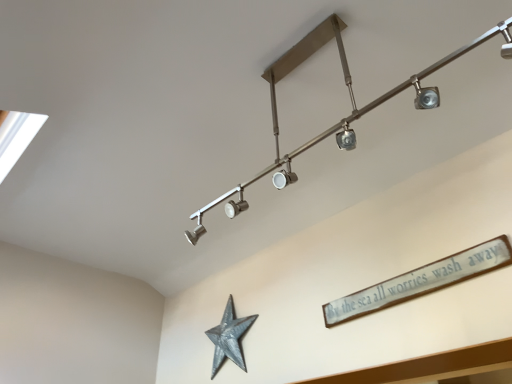
Question: From a real-world perspective, is satin nickel track light at upper center positioned above or below galvanized metal star at lower center?

Choices:
 (A) above
 (B) below

Answer: (A)

Question: Relative to galvanized metal star at lower center, is satin nickel track light at upper center in front or behind?

Choices:
 (A) behind
 (B) front

Answer: (B)

Question: Which is nearer to the white wooden sign at upper right?

Choices:
 (A) galvanized metal star at lower center
 (B) satin nickel track light at upper center

Answer: (B)

Question: Which of these objects is positioned farthest from the satin nickel track light at upper center?

Choices:
 (A) galvanized metal star at lower center
 (B) white wooden sign at upper right

Answer: (A)